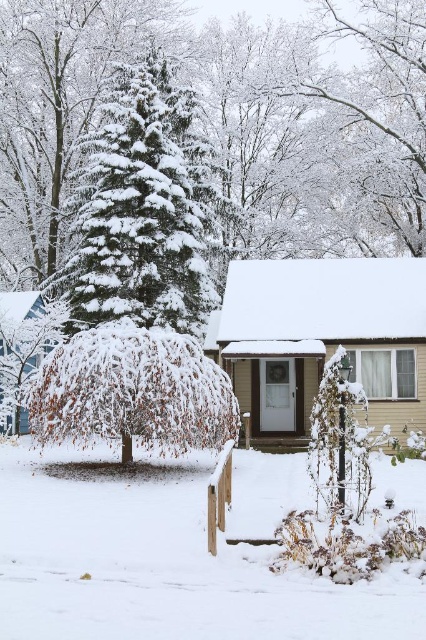
Question: Is white fluffy snow at lower center wider than white frosty branches at upper center?

Choices:
 (A) yes
 (B) no

Answer: (B)

Question: Based on their relative distances, which object is farther from the white frosty branches at upper center?

Choices:
 (A) green textured pine at center
 (B) snow-covered weeping willow at center

Answer: (B)

Question: Which of the following is the closest to the observer?

Choices:
 (A) (92, 362)
 (B) (123, 292)

Answer: (A)

Question: Does white fluffy snow at lower center come behind snow-covered weeping willow at center?

Choices:
 (A) yes
 (B) no

Answer: (B)

Question: Can you confirm if white fluffy snow at lower center is smaller than green textured pine at center?

Choices:
 (A) no
 (B) yes

Answer: (B)

Question: Among these points, which one is farthest from the camera?

Choices:
 (A) (25, 451)
 (B) (206, 392)

Answer: (A)